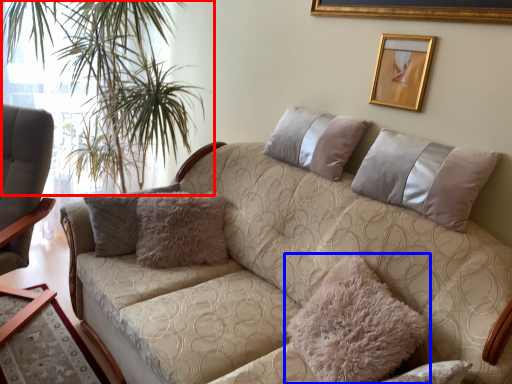
Question: Which of the following is the closest to the observer, plant (highlighted by a red box) or pillow (highlighted by a blue box)?

Choices:
 (A) plant
 (B) pillow

Answer: (B)